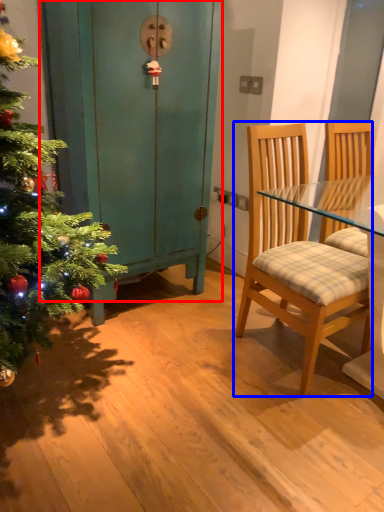
Question: Which of the following is the closest to the observer, dresser (highlighted by a red box) or chair (highlighted by a blue box)?

Choices:
 (A) dresser
 (B) chair

Answer: (B)